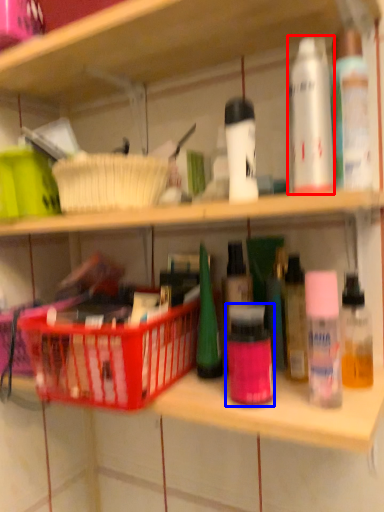
Question: Which point is further to the camera, mouthwash (highlighted by a red box) or toiletry (highlighted by a blue box)?

Choices:
 (A) mouthwash
 (B) toiletry

Answer: (B)